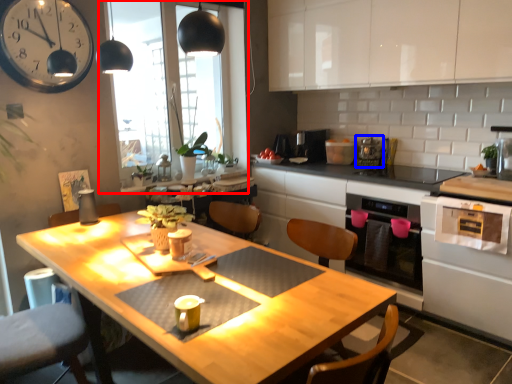
Question: Which object appears farthest to the camera in this image, window (highlighted by a red box) or appliance (highlighted by a blue box)?

Choices:
 (A) window
 (B) appliance

Answer: (B)